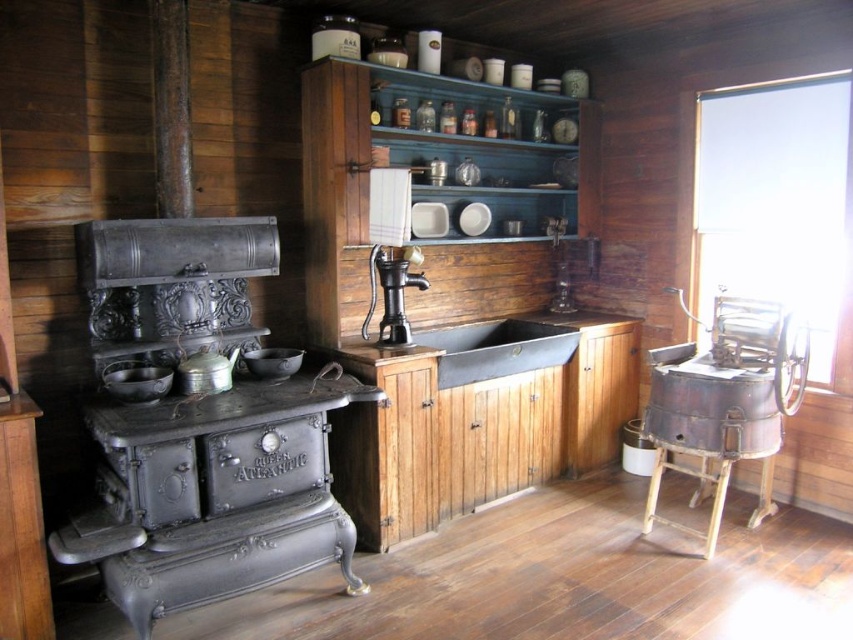
Based on the photo, you are a chef preparing to wash vegetables in the kitchen. You need to choose between the black cast iron sink at center and the shiny metallic bowl at center. Which one has a bigger capacity for holding water?

The black cast iron sink at center has a larger size compared to the shiny metallic bowl at center, so it can hold more water.

You are standing in the rustic kitchen and want to place a new spice jar on the shelf above the stove. The point you are aiming for is at coordinates point (136,380). Can you tell me what object is located at that point?

The point (136,380) is on the matte black pot at left.

You are standing in the rustic kitchen and need to reach both the point at coordinates point [408,248] and the point at coordinates point [144,381]. Which point is closer to you?

Point [144,381] is closer to you because it is in front of point [408,248].